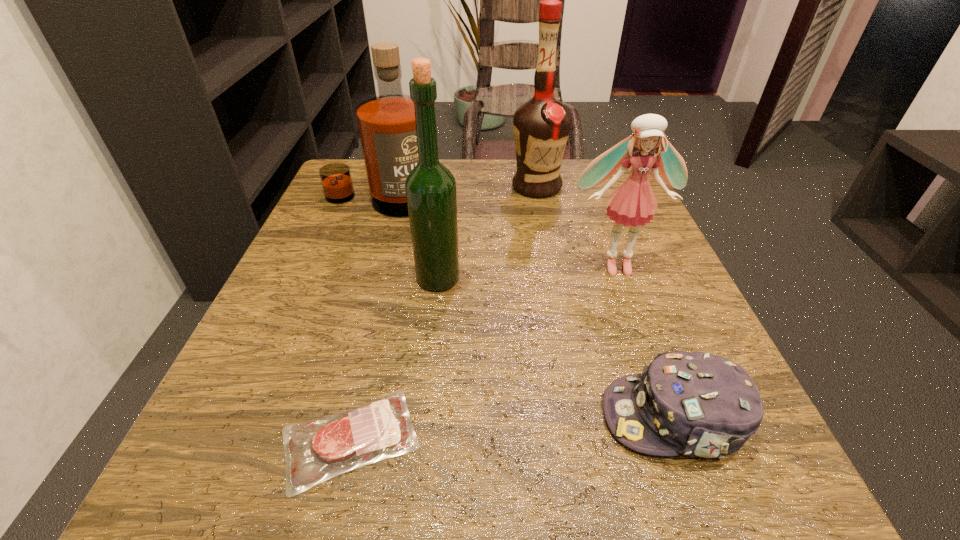
Locate which liquor is the second closest to the rightmost liquor. Please provide its 2D coordinates. Your answer should be formatted as a tuple, i.e. [(x, y)], where the tuple contains the x and y coordinates of a point satisfying the conditions above.

[(430, 187)]

Locate which liquor ranks second in proximity to the nearest liquor. Please provide its 2D coordinates. Your answer should be formatted as a tuple, i.e. [(x, y)], where the tuple contains the x and y coordinates of a point satisfying the conditions above.

[(541, 126)]